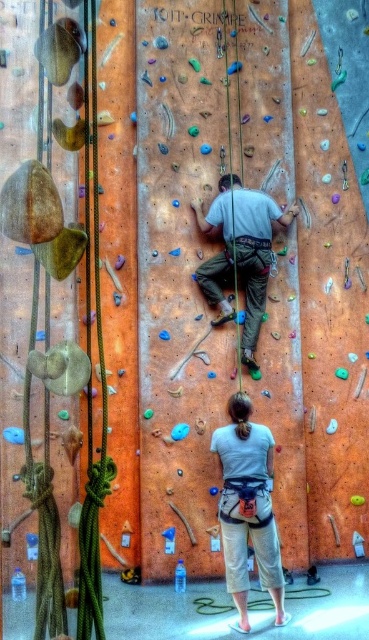
From the picture: You are a visitor observing the indoor rock climbing scene. You notice two pairs of pants on climbers. The light beige pants at lower center and the green fabric pants at center. Which pair is shorter?

The light beige pants at lower center is shorter than the green fabric pants at center.

You are a photographer trying to capture a climber on the wall. You notice the light beige pants at lower center and the green fabric pants at center. Which pair of pants is closer to the bottom of the image?

The light beige pants at lower center is below green fabric pants at center, so it is closer to the bottom of the image.

In the scene shown: You are a photographer trying to capture a climber in an indoor rock climbing scene. You notice two sets of pants on the climber. The light beige pants at lower center and the green fabric pants at center. Which pants are positioned to the right side of the other?

The light beige pants at lower center are positioned to the right of the green fabric pants at center.